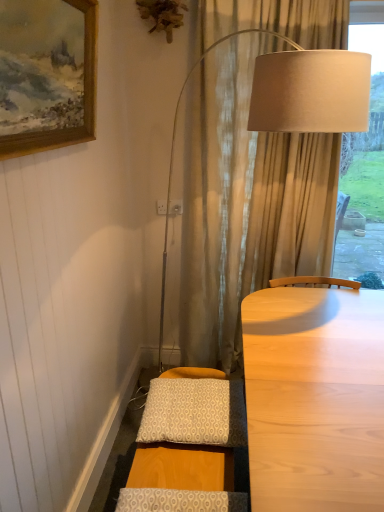
Question: From the image's perspective, is wooden framed painting at upper left below patterned fabric pillow at lower center, the 1th pillow from the back?

Choices:
 (A) no
 (B) yes

Answer: (A)

Question: Does wooden framed painting at upper left have a lesser height compared to patterned fabric pillow at lower center, the 1th pillow from the back?

Choices:
 (A) yes
 (B) no

Answer: (B)

Question: Is wooden framed painting at upper left turned away from patterned fabric pillow at lower center, which ranks as the 1th pillow in top-to-bottom order?

Choices:
 (A) yes
 (B) no

Answer: (B)

Question: Does wooden framed painting at upper left have a larger size compared to patterned fabric pillow at lower center, the second pillow ordered from the bottom?

Choices:
 (A) no
 (B) yes

Answer: (B)

Question: Does wooden framed painting at upper left appear on the right side of patterned fabric pillow at lower center, which ranks as the 1th pillow in top-to-bottom order?

Choices:
 (A) yes
 (B) no

Answer: (B)

Question: Does wooden framed painting at upper left have a greater width compared to patterned fabric pillow at lower center, the second pillow in the front-to-back sequence?

Choices:
 (A) no
 (B) yes

Answer: (A)

Question: Does wooden framed painting at upper left have a lesser width compared to patterned fabric pillow at lower center, the 2th pillow viewed from the top?

Choices:
 (A) yes
 (B) no

Answer: (A)

Question: From a real-world perspective, is wooden framed painting at upper left located beneath patterned fabric pillow at lower center, arranged as the second pillow when viewed from the back?

Choices:
 (A) no
 (B) yes

Answer: (A)

Question: Does wooden framed painting at upper left touch patterned fabric pillow at lower center, arranged as the second pillow when viewed from the back?

Choices:
 (A) no
 (B) yes

Answer: (A)

Question: Is wooden framed painting at upper left at the left side of patterned fabric pillow at lower center, arranged as the second pillow when viewed from the back?

Choices:
 (A) yes
 (B) no

Answer: (A)

Question: Considering the relative positions of wooden framed painting at upper left and patterned fabric pillow at lower center, the first pillow viewed from the front, in the image provided, is wooden framed painting at upper left behind patterned fabric pillow at lower center, the first pillow viewed from the front,?

Choices:
 (A) no
 (B) yes

Answer: (A)

Question: Could patterned fabric pillow at lower center, arranged as the second pillow when viewed from the back, be considered to be inside wooden framed painting at upper left?

Choices:
 (A) no
 (B) yes

Answer: (A)

Question: Can you confirm if patterned fabric pillow at lower center, which ranks as the 1th pillow in top-to-bottom order, is thinner than wooden framed painting at upper left?

Choices:
 (A) yes
 (B) no

Answer: (B)